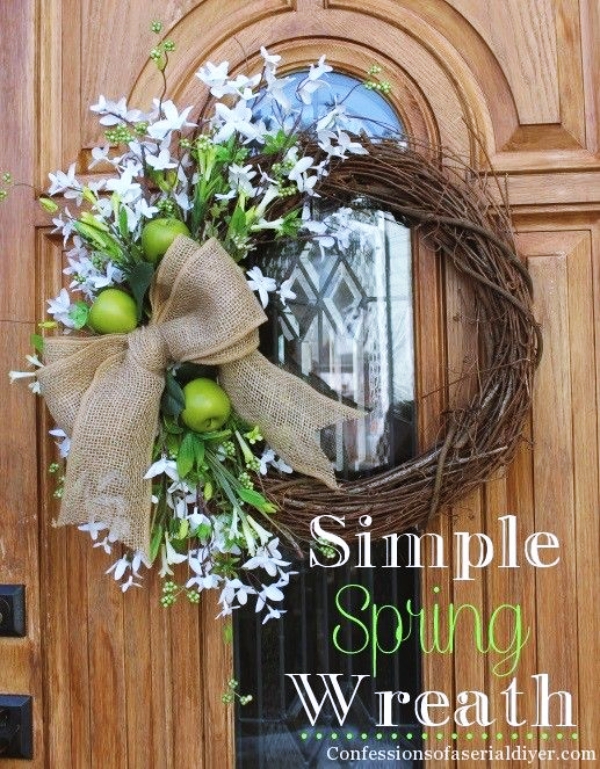
The image size is (600, 769). I want to click on you hang the wreath here, so click(342, 172).